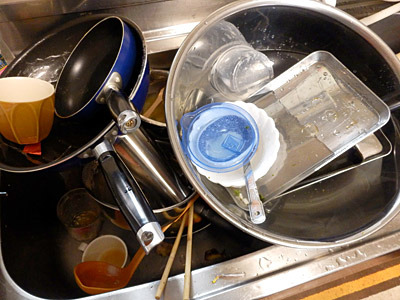
Where is `black nonstick pan`? black nonstick pan is located at coordinates (76, 130).